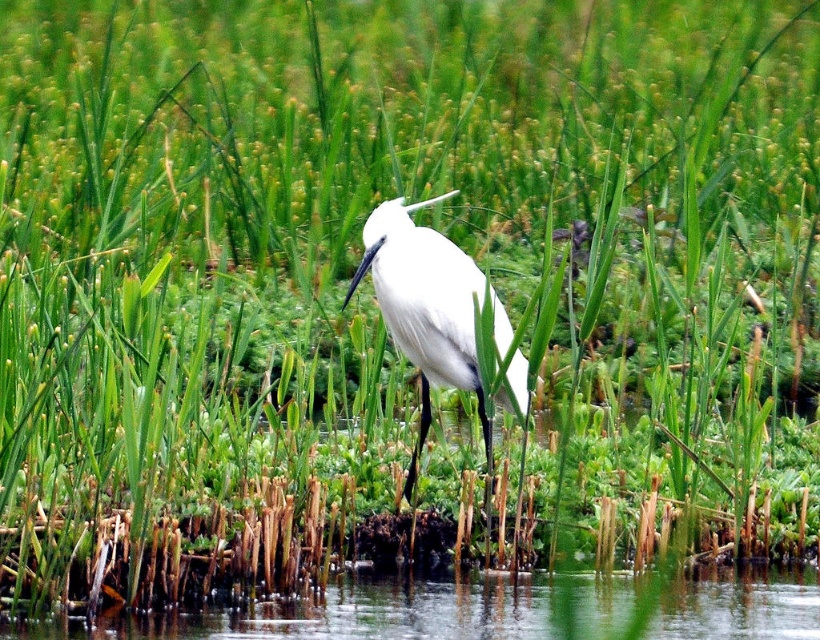
Question: Among these points, which one is farthest from the camera?

Choices:
 (A) (622, 611)
 (B) (458, 381)

Answer: (B)

Question: Which point is farther to the camera?

Choices:
 (A) (358, 273)
 (B) (340, 602)

Answer: (B)

Question: Which point is farther from the camera taking this photo?

Choices:
 (A) (395, 285)
 (B) (443, 625)

Answer: (A)

Question: Considering the relative positions of transparent water at lower center and white matte bird at center in the image provided, where is transparent water at lower center located with respect to white matte bird at center?

Choices:
 (A) above
 (B) below

Answer: (B)

Question: From the image, what is the correct spatial relationship of transparent water at lower center in relation to white matte bird at center?

Choices:
 (A) below
 (B) above

Answer: (A)

Question: Is transparent water at lower center positioned at the back of white matte bird at center?

Choices:
 (A) no
 (B) yes

Answer: (A)